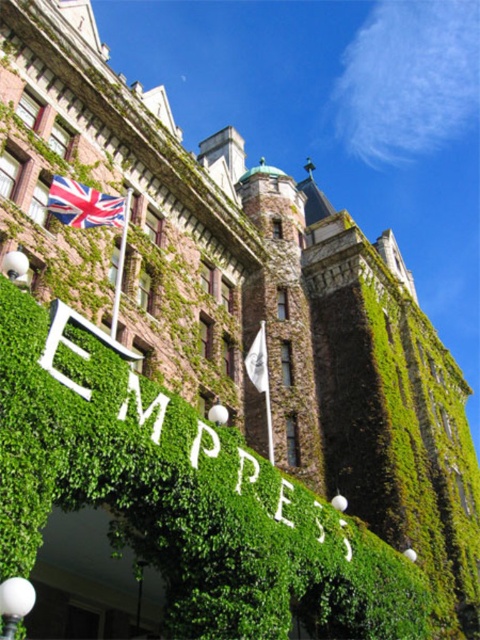
Which is below, union jack fabric flag at upper left or white fabric flag at center?

Positioned lower is white fabric flag at center.

Is union jack fabric flag at upper left bigger than white fabric flag at center?

Indeed, union jack fabric flag at upper left has a larger size compared to white fabric flag at center.

What do you see at coordinates (84, 204) in the screenshot? I see `union jack fabric flag at upper left` at bounding box center [84, 204].

Identify the location of union jack fabric flag at upper left. The width and height of the screenshot is (480, 640). (84, 204).